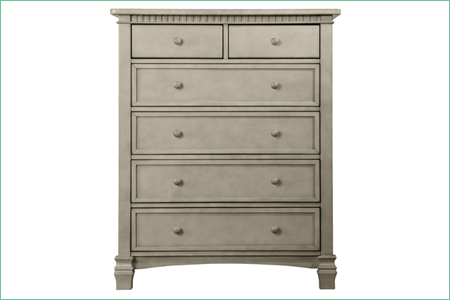
Where is `drawer knob`? The width and height of the screenshot is (450, 300). drawer knob is located at coordinates (178, 43), (274, 41), (276, 84), (180, 83), (178, 135), (276, 135), (278, 182), (177, 182), (180, 233), (274, 231).